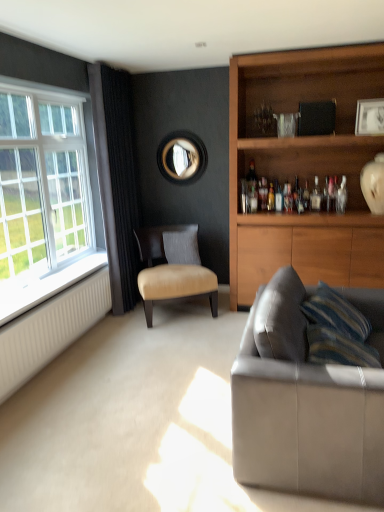
Question: Does white plastic window at left have a lesser width compared to leather couch at lower right?

Choices:
 (A) no
 (B) yes

Answer: (B)

Question: From the image's perspective, is white plastic window at left beneath leather couch at lower right?

Choices:
 (A) yes
 (B) no

Answer: (B)

Question: From a real-world perspective, is white plastic window at left physically above leather couch at lower right?

Choices:
 (A) no
 (B) yes

Answer: (B)

Question: Is white plastic window at left facing towards leather couch at lower right?

Choices:
 (A) yes
 (B) no

Answer: (A)

Question: From the image's perspective, is white plastic window at left located above leather couch at lower right?

Choices:
 (A) no
 (B) yes

Answer: (B)

Question: From a real-world perspective, is suede gray pillow at center physically located above or below clear glass bottle at upper right, which is counted as the first bottle, starting from the right?

Choices:
 (A) below
 (B) above

Answer: (A)

Question: Is point (183, 253) positioned closer to the camera than point (342, 203)?

Choices:
 (A) closer
 (B) farther

Answer: (B)

Question: Considering the positions of suede gray pillow at center and clear glass bottle at upper right, which is counted as the first bottle, starting from the right, in the image, is suede gray pillow at center taller or shorter than clear glass bottle at upper right, which is counted as the first bottle, starting from the right,?

Choices:
 (A) tall
 (B) short

Answer: (A)

Question: Considering the positions of suede gray pillow at center and clear glass bottle at upper right, the second bottle when ordered from left to right, in the image, is suede gray pillow at center wider or thinner than clear glass bottle at upper right, the second bottle when ordered from left to right,?

Choices:
 (A) wide
 (B) thin

Answer: (A)

Question: From a real-world perspective, is white plastic window at left positioned above or below translucent glass bottle at shelf center, the second bottle from the right?

Choices:
 (A) above
 (B) below

Answer: (A)

Question: From the image's perspective, is white plastic window at left positioned above or below translucent glass bottle at shelf center, acting as the 2th bottle starting from the front?

Choices:
 (A) below
 (B) above

Answer: (A)

Question: In terms of height, does white plastic window at left look taller or shorter compared to translucent glass bottle at shelf center, acting as the 2th bottle starting from the front?

Choices:
 (A) tall
 (B) short

Answer: (A)

Question: Is white plastic window at left inside the boundaries of translucent glass bottle at shelf center, acting as the 2th bottle starting from the front, or outside?

Choices:
 (A) outside
 (B) inside

Answer: (A)

Question: Looking at the image, does white painted wood at left seem bigger or smaller compared to translucent glass bottle at shelf center, the second bottle from the right?

Choices:
 (A) big
 (B) small

Answer: (A)

Question: Considering the positions of point (64, 287) and point (299, 208), is point (64, 287) closer or farther from the camera than point (299, 208)?

Choices:
 (A) farther
 (B) closer

Answer: (B)